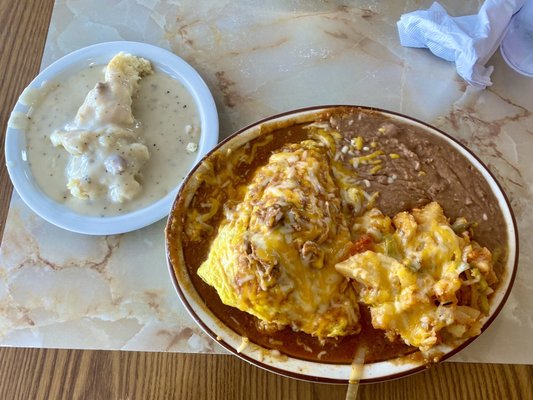
Find the location of `outer rim of bowl`. outer rim of bowl is located at coordinates (201, 96).